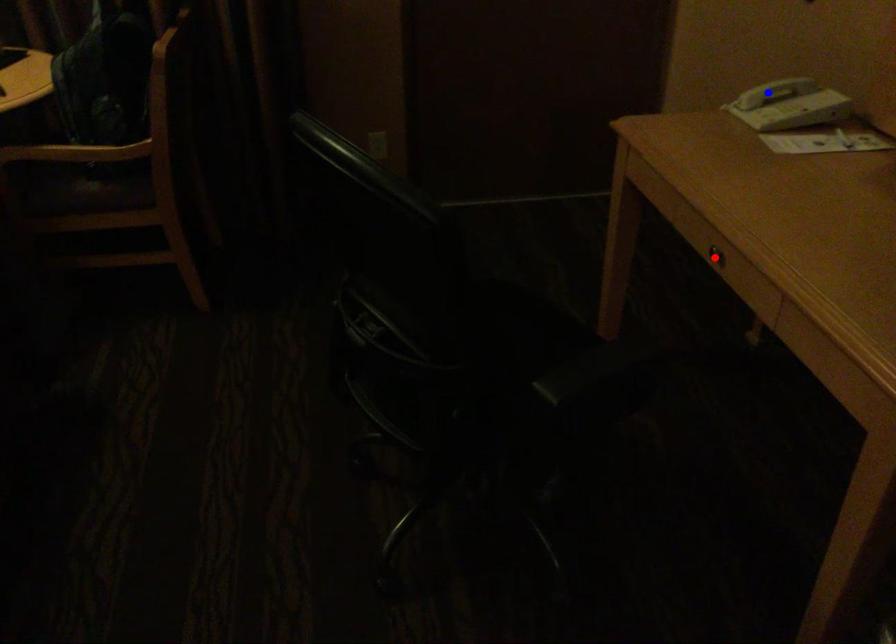
Question: Which of the two points in the image is closer to the camera?

Choices:
 (A) Blue point is closer.
 (B) Red point is closer.

Answer: (B)